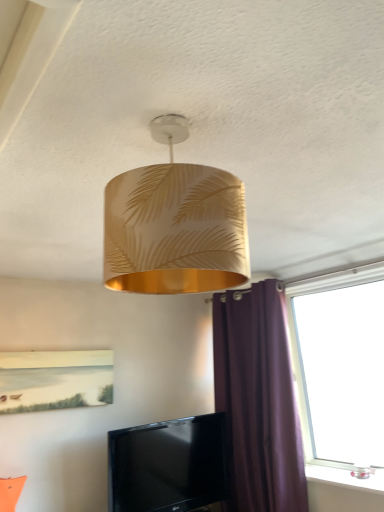
Question: Considering the relative sizes of gold leaf-patterned lampshade at upper center and black glossy tv at lower center in the image provided, is gold leaf-patterned lampshade at upper center smaller than black glossy tv at lower center?

Choices:
 (A) no
 (B) yes

Answer: (A)

Question: Would you say black glossy tv at lower center is part of gold leaf-patterned lampshade at upper center's contents?

Choices:
 (A) no
 (B) yes

Answer: (A)

Question: Is gold leaf-patterned lampshade at upper center positioned with its back to black glossy tv at lower center?

Choices:
 (A) yes
 (B) no

Answer: (B)

Question: Does gold leaf-patterned lampshade at upper center lie behind black glossy tv at lower center?

Choices:
 (A) yes
 (B) no

Answer: (B)

Question: Is gold leaf-patterned lampshade at upper center positioned before black glossy tv at lower center?

Choices:
 (A) no
 (B) yes

Answer: (B)

Question: Does gold leaf-patterned lampshade at upper center have a lesser width compared to black glossy tv at lower center?

Choices:
 (A) no
 (B) yes

Answer: (A)

Question: Is purple fabric curtain at right smaller than transparent glass window at right?

Choices:
 (A) no
 (B) yes

Answer: (A)

Question: From a real-world perspective, is purple fabric curtain at right on top of transparent glass window at right?

Choices:
 (A) yes
 (B) no

Answer: (B)

Question: Is purple fabric curtain at right further to camera compared to transparent glass window at right?

Choices:
 (A) no
 (B) yes

Answer: (B)

Question: Does purple fabric curtain at right have a greater width compared to transparent glass window at right?

Choices:
 (A) no
 (B) yes

Answer: (B)

Question: Could you tell me if purple fabric curtain at right is facing transparent glass window at right?

Choices:
 (A) yes
 (B) no

Answer: (B)

Question: Considering the relative sizes of purple fabric curtain at right and transparent glass window at right in the image provided, is purple fabric curtain at right shorter than transparent glass window at right?

Choices:
 (A) yes
 (B) no

Answer: (B)

Question: From the image's perspective, is transparent glass window at right under black glossy tv at lower center?

Choices:
 (A) yes
 (B) no

Answer: (B)